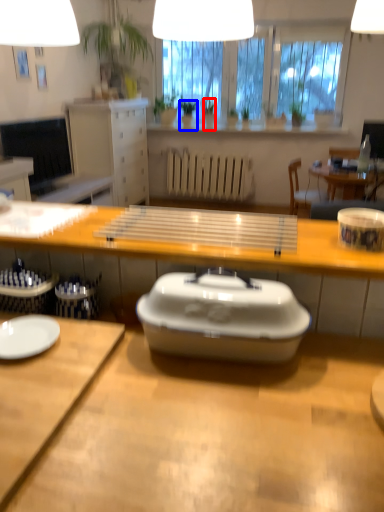
Question: Which of the following is the farthest to the observer, houseplant (highlighted by a red box) or houseplant (highlighted by a blue box)?

Choices:
 (A) houseplant
 (B) houseplant

Answer: (B)